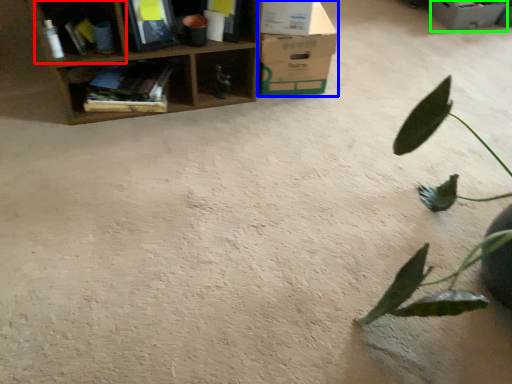
Question: Which object is positioned closest to shelf (highlighted by a red box)? Select from cardboard box (highlighted by a blue box) and cardboard box (highlighted by a green box).

Choices:
 (A) cardboard box
 (B) cardboard box

Answer: (A)